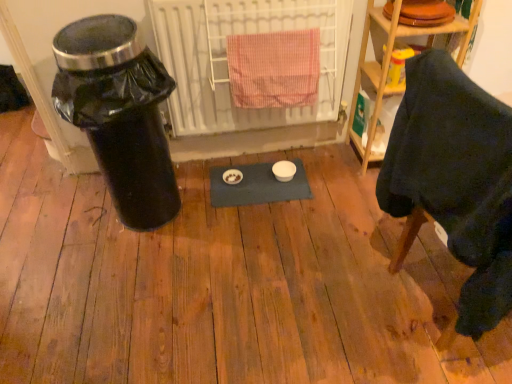
Where is `vacant space that's between dark fabric chair at lower right and black plastic trash can at left`? This screenshot has width=512, height=384. vacant space that's between dark fabric chair at lower right and black plastic trash can at left is located at coordinates (276, 246).